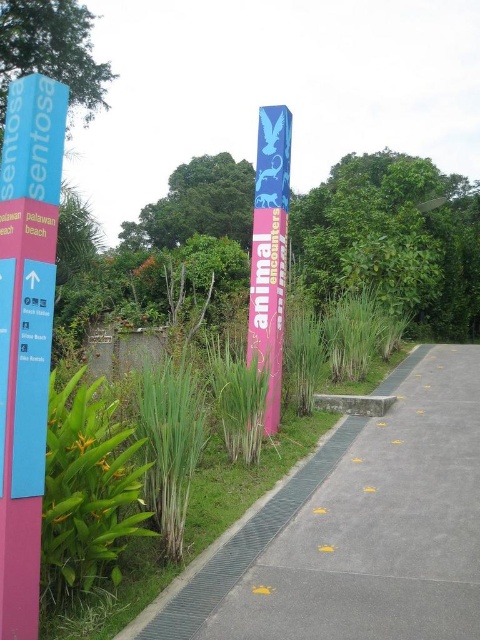
Does blue plastic sign at left have a larger size compared to pink glossy pole at center?

Yes.

Between point (36, 336) and point (268, 198), which one is positioned behind?

The point (268, 198) is behind.

The width and height of the screenshot is (480, 640). What are the coordinates of `blue plastic sign at left` in the screenshot? It's located at (25, 333).